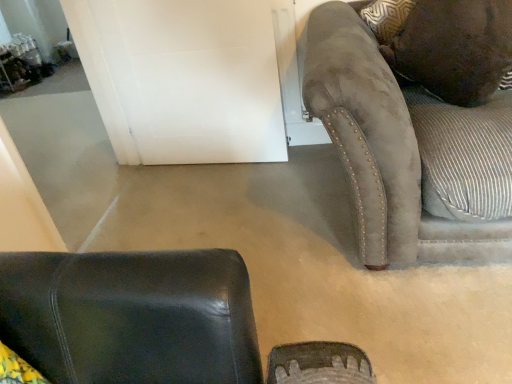
Where is `vacant region in front of white matte door at upper center`? The width and height of the screenshot is (512, 384). vacant region in front of white matte door at upper center is located at coordinates pyautogui.click(x=217, y=203).